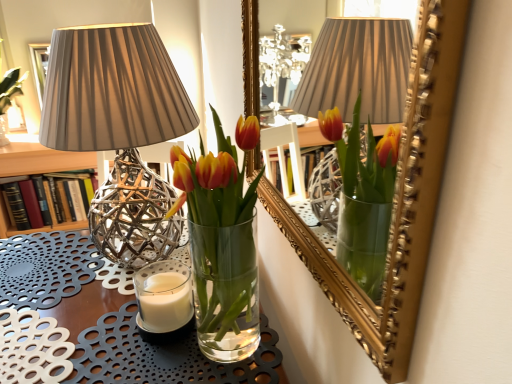
The height and width of the screenshot is (384, 512). Identify the location of free spot in front of white wax candle at lower left. (151, 360).